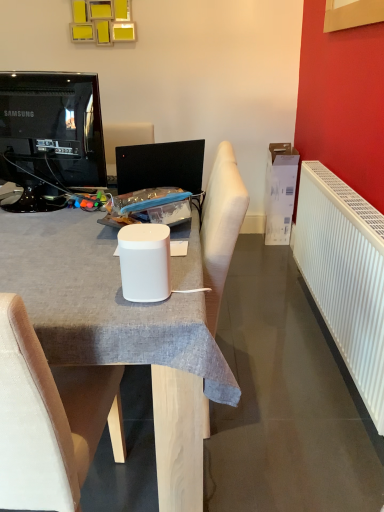
Question: Is white matte speaker at center oriented away from white fabric chair at center?

Choices:
 (A) yes
 (B) no

Answer: (B)

Question: Can you confirm if white matte speaker at center is bigger than white fabric chair at center?

Choices:
 (A) no
 (B) yes

Answer: (A)

Question: Is white matte speaker at center taller than white fabric chair at center?

Choices:
 (A) no
 (B) yes

Answer: (A)

Question: Can you confirm if white matte speaker at center is positioned to the right of white fabric chair at center?

Choices:
 (A) yes
 (B) no

Answer: (A)

Question: Can you confirm if white matte speaker at center is wider than white fabric chair at center?

Choices:
 (A) yes
 (B) no

Answer: (B)

Question: Is white matte speaker at center outside white fabric chair at center?

Choices:
 (A) yes
 (B) no

Answer: (A)

Question: Can you confirm if white fabric chair at center is positioned to the left of white matte speaker at center?

Choices:
 (A) no
 (B) yes

Answer: (B)

Question: Is white fabric chair at center facing away from white matte speaker at center?

Choices:
 (A) no
 (B) yes

Answer: (A)

Question: Does white fabric chair at center have a lesser height compared to white matte speaker at center?

Choices:
 (A) no
 (B) yes

Answer: (A)

Question: Can you confirm if white fabric chair at center is taller than white matte speaker at center?

Choices:
 (A) no
 (B) yes

Answer: (B)

Question: Would you say white fabric chair at center is a long distance from white matte speaker at center?

Choices:
 (A) yes
 (B) no

Answer: (B)

Question: Is white fabric chair at center beside white matte speaker at center?

Choices:
 (A) no
 (B) yes

Answer: (A)

Question: Is white matte speaker at center behind white plastic radiator at right?

Choices:
 (A) yes
 (B) no

Answer: (B)